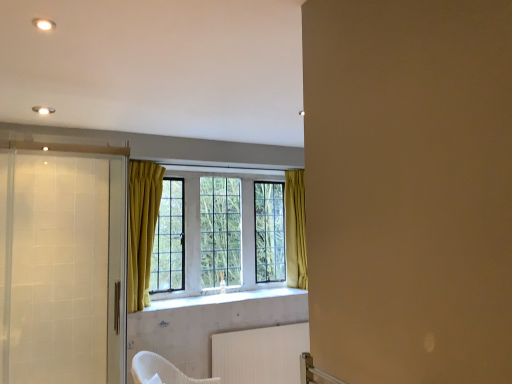
Question: Is there a large distance between white textured tile at center and translucent glass screen door at left, which is the second screen door from back to front?

Choices:
 (A) yes
 (B) no

Answer: (B)

Question: Can you confirm if white textured tile at center is bigger than translucent glass screen door at left, which is the second screen door from back to front?

Choices:
 (A) yes
 (B) no

Answer: (B)

Question: Is white textured tile at center at the left side of translucent glass screen door at left, which is the second screen door from back to front?

Choices:
 (A) yes
 (B) no

Answer: (B)

Question: From the image's perspective, is white textured tile at center below translucent glass screen door at left, which is the second screen door from back to front?

Choices:
 (A) no
 (B) yes

Answer: (B)

Question: Is white textured tile at center at the right side of translucent glass screen door at left, the 1th screen door viewed from the front?

Choices:
 (A) yes
 (B) no

Answer: (A)

Question: Can you confirm if white textured tile at center is wider than translucent glass screen door at left, the 1th screen door viewed from the front?

Choices:
 (A) yes
 (B) no

Answer: (A)

Question: Is clear glass window at center far away from translucent glass screen door at left, which is the second screen door from back to front?

Choices:
 (A) yes
 (B) no

Answer: (B)

Question: Is clear glass window at center thinner than translucent glass screen door at left, which is the second screen door from back to front?

Choices:
 (A) no
 (B) yes

Answer: (A)

Question: Does clear glass window at center appear on the right side of translucent glass screen door at left, the 1th screen door viewed from the front?

Choices:
 (A) yes
 (B) no

Answer: (A)

Question: Is clear glass window at center located outside translucent glass screen door at left, the 1th screen door viewed from the front?

Choices:
 (A) yes
 (B) no

Answer: (A)

Question: Does clear glass window at center come in front of translucent glass screen door at left, the 1th screen door viewed from the front?

Choices:
 (A) no
 (B) yes

Answer: (A)

Question: Is translucent glass screen door at left, which is the second screen door from back to front, a part of clear glass window at center?

Choices:
 (A) no
 (B) yes

Answer: (A)

Question: Is white textured radiator at lower center oriented away from clear glass screen door at left, the 2th screen door when ordered from front to back?

Choices:
 (A) no
 (B) yes

Answer: (A)